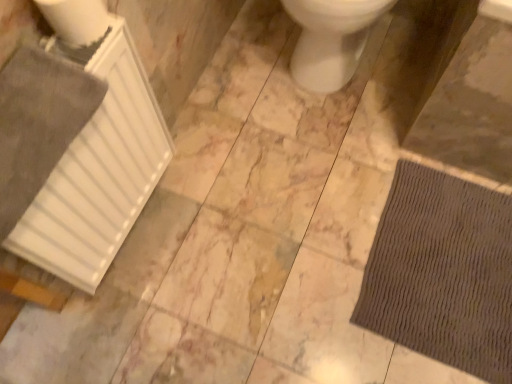
Where is `brown textured mat at lower right`? The image size is (512, 384). brown textured mat at lower right is located at coordinates (442, 272).

Where is `white matte radiator at left`? The width and height of the screenshot is (512, 384). white matte radiator at left is located at coordinates tap(99, 171).

Identify the location of white glossy toilet at center. This screenshot has width=512, height=384. (331, 39).

What is the approximate width of white glossy toilet at center?

It is 22.45 inches.

The image size is (512, 384). Identify the location of brown textured mat at lower right. (442, 272).

Can you confirm if white glossy toilet at center is shorter than brown textured mat at lower right?

Incorrect, the height of white glossy toilet at center does not fall short of that of brown textured mat at lower right.

Is there a large distance between white glossy toilet at center and brown textured mat at lower right?

white glossy toilet at center is near brown textured mat at lower right, not far away.

Is white glossy toilet at center bigger or smaller than brown textured mat at lower right?

white glossy toilet at center is bigger than brown textured mat at lower right.

From the image's perspective, between white glossy toilet at center and brown textured mat at lower right, which one is located above?

white glossy toilet at center.

Is white glossy toilet at center spatially inside white matte radiator at left, or outside of it?

white glossy toilet at center exists outside the volume of white matte radiator at left.

From a real-world perspective, is white glossy toilet at center physically below white matte radiator at left?

Yes, from a real-world perspective, white glossy toilet at center is under white matte radiator at left.

Between white glossy toilet at center and white matte radiator at left, which one has more height?

white matte radiator at left is taller.

Is white glossy toilet at center in front of or behind white matte radiator at left in the image?

white glossy toilet at center is positioned farther from the viewer than white matte radiator at left.

Considering the relative positions of white matte radiator at left and white glossy toilet at center in the image provided, is white matte radiator at left behind white glossy toilet at center?

No.

From the image's perspective, between white matte radiator at left and white glossy toilet at center, who is located below?

From the image's view, white matte radiator at left is below.

In the scene shown: Could you tell me if white matte radiator at left is facing white glossy toilet at center?

No, white matte radiator at left is not aimed at white glossy toilet at center.

How distant is white matte radiator at left from brown textured mat at lower right?

The distance of white matte radiator at left from brown textured mat at lower right is 29.46 inches.

Which object is further away from the camera, white matte radiator at left or brown textured mat at lower right?

Positioned behind is brown textured mat at lower right.

Consider the image. From a real-world perspective, relative to brown textured mat at lower right, is white matte radiator at left vertically above or below?

In terms of real-world spatial position, white matte radiator at left is above brown textured mat at lower right.

From the image's perspective, which is above, white matte radiator at left or brown textured mat at lower right?

white matte radiator at left appears higher in the image.

Which of these two, brown textured mat at lower right or white matte radiator at left, is thinner?

white matte radiator at left.

Find the location of `radiator located above the brown textured mat at lower right (from a real-world perspective)`. radiator located above the brown textured mat at lower right (from a real-world perspective) is located at coordinates (99, 171).

Is brown textured mat at lower right not near white matte radiator at left?

No, brown textured mat at lower right is in close proximity to white matte radiator at left.

Which of these two, brown textured mat at lower right or white glossy toilet at center, stands shorter?

brown textured mat at lower right is shorter.

From the image's perspective, does brown textured mat at lower right appear higher than white glossy toilet at center?

No, from the image's perspective, brown textured mat at lower right is not over white glossy toilet at center.

Is brown textured mat at lower right positioned before white glossy toilet at center?

No, brown textured mat at lower right is behind white glossy toilet at center.

Is brown textured mat at lower right not inside white glossy toilet at center?

Yes, brown textured mat at lower right is not within white glossy toilet at center.

This screenshot has height=384, width=512. In order to click on doormat below the white glossy toilet at center (from a real-world perspective) in this screenshot , I will do `click(442, 272)`.

Identify the location of toilet on the right of white matte radiator at left. (331, 39).

Considering their positions, is white glossy toilet at center positioned further to white matte radiator at left than brown textured mat at lower right?

The object further to white matte radiator at left is brown textured mat at lower right.

Estimate the real-world distances between objects in this image. Which object is further from white matte radiator at left, brown textured mat at lower right or white glossy toilet at center?

Based on the image, brown textured mat at lower right appears to be further to white matte radiator at left.

Which object lies further to the anchor point white glossy toilet at center, white matte radiator at left or brown textured mat at lower right?

Based on the image, white matte radiator at left appears to be further to white glossy toilet at center.

In the scene shown: Which object lies nearer to the anchor point white glossy toilet at center, brown textured mat at lower right or white matte radiator at left?

Among the two, brown textured mat at lower right is located nearer to white glossy toilet at center.

When comparing their distances from brown textured mat at lower right, does white matte radiator at left or white glossy toilet at center seem further?

white matte radiator at left is positioned further to the anchor brown textured mat at lower right.

Looking at the image, which one is located further to brown textured mat at lower right, white glossy toilet at center or white matte radiator at left?

Among the two, white matte radiator at left is located further to brown textured mat at lower right.

This screenshot has height=384, width=512. What are the coordinates of `toilet situated between white matte radiator at left and brown textured mat at lower right from left to right` in the screenshot? It's located at (331, 39).